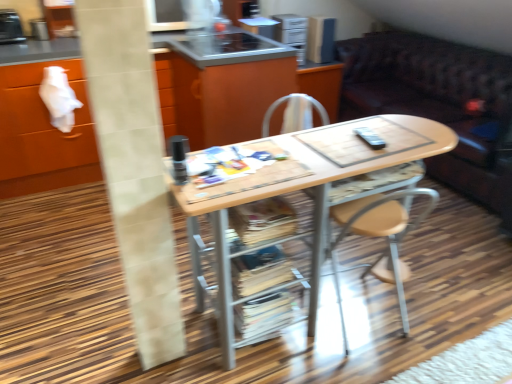
What do you see at coordinates (320, 39) in the screenshot? I see `metallic silver toaster at upper center, placed as the first appliance when sorted from right to left` at bounding box center [320, 39].

Locate an element on the screen. This screenshot has height=384, width=512. wooden/matte desk at center is located at coordinates (316, 205).

Find the location of a particular element. This screenshot has width=512, height=384. wooden cabinet at center is located at coordinates (42, 134).

Image resolution: width=512 pixels, height=384 pixels. In order to click on brown leather couch at center in this screenshot , I will do `click(439, 104)`.

This screenshot has height=384, width=512. Identify the location of metallic stainless steel toaster at upper left, the first appliance in the left-to-right sequence. (10, 27).

Locate an element on the screen. This screenshot has height=384, width=512. white tile pillar at left is located at coordinates (134, 168).

Where is `metallic silver toaster at upper center, the third appliance in the front-to-back sequence`? This screenshot has height=384, width=512. metallic silver toaster at upper center, the third appliance in the front-to-back sequence is located at coordinates (320, 39).

From the image's perspective, relative to wooden cabinet at center, is metallic silver toaster at upper center, the third appliance in the front-to-back sequence, above or below?

From the image's perspective, metallic silver toaster at upper center, the third appliance in the front-to-back sequence, appears above wooden cabinet at center.

Is metallic silver toaster at upper center, placed as the first appliance when sorted from right to left, thinner than wooden cabinet at center?

Correct, the width of metallic silver toaster at upper center, placed as the first appliance when sorted from right to left, is less than that of wooden cabinet at center.

How different are the orientations of metallic silver toaster at upper center, the 3th appliance viewed from the left, and wooden cabinet at center in degrees?

There is a 0.000151-degree angle between the facing directions of metallic silver toaster at upper center, the 3th appliance viewed from the left, and wooden cabinet at center.

Considering the positions of objects metallic silver toaster at upper center, placed as the 1th appliance when sorted from back to front, and wooden cabinet at center in the image provided, who is more to the right, metallic silver toaster at upper center, placed as the 1th appliance when sorted from back to front, or wooden cabinet at center?

metallic silver toaster at upper center, placed as the 1th appliance when sorted from back to front, is more to the right.

Could you tell me if brown leather couch at center is facing wooden/matte desk at center?

Yes, brown leather couch at center is aimed at wooden/matte desk at center.

Based on the photo, considering the relative sizes of brown leather couch at center and wooden/matte desk at center in the image provided, is brown leather couch at center taller than wooden/matte desk at center?

In fact, brown leather couch at center may be shorter than wooden/matte desk at center.

Which of these two, brown leather couch at center or wooden/matte desk at center, is thinner?

wooden/matte desk at center is thinner.

Considering the relative sizes of white tile pillar at left and metallic silver microwave at upper center, which is the second appliance in back-to-front order, in the image provided, is white tile pillar at left thinner than metallic silver microwave at upper center, which is the second appliance in back-to-front order,?

Correct, the width of white tile pillar at left is less than that of metallic silver microwave at upper center, which is the second appliance in back-to-front order.

Where is `pillar on the left of metallic silver microwave at upper center, which is the 2th appliance from right to left`? pillar on the left of metallic silver microwave at upper center, which is the 2th appliance from right to left is located at coordinates (134, 168).

From a real-world perspective, is white tile pillar at left physically below metallic silver microwave at upper center, which is the second appliance in back-to-front order?

Yes.

Can you confirm if white tile pillar at left is smaller than metallic silver microwave at upper center, which is the second appliance in back-to-front order?

No, white tile pillar at left is not smaller than metallic silver microwave at upper center, which is the second appliance in back-to-front order.

Is metallic silver toaster at upper center, the 3th appliance viewed from the left, wider than white tile pillar at left?

Correct, the width of metallic silver toaster at upper center, the 3th appliance viewed from the left, exceeds that of white tile pillar at left.

Is metallic silver toaster at upper center, placed as the first appliance when sorted from right to left, surrounding white tile pillar at left?

Definitely not — white tile pillar at left is not inside metallic silver toaster at upper center, placed as the first appliance when sorted from right to left.

Which is closer, (318, 60) or (121, 162)?

Point (121, 162)

Is metallic silver toaster at upper center, the third appliance in the front-to-back sequence, far from white tile pillar at left?

Yes, metallic silver toaster at upper center, the third appliance in the front-to-back sequence, and white tile pillar at left are located far from each other.

From a real-world perspective, which is physically above, white tile pillar at left or wooden/matte desk at center?

In real-world perspective, white tile pillar at left is above.

Which of these two, white tile pillar at left or wooden/matte desk at center, stands taller?

white tile pillar at left is taller.

Is white tile pillar at left positioned with its back to wooden/matte desk at center?

A: That's not correct — white tile pillar at left is not looking away from wooden/matte desk at center.

Are white tile pillar at left and wooden/matte desk at center far apart?

white tile pillar at left is actually quite close to wooden/matte desk at center.

Is wooden/matte desk at center beside metallic silver microwave at upper center, which is the 2th appliance from right to left?

wooden/matte desk at center and metallic silver microwave at upper center, which is the 2th appliance from right to left, are clearly separated.

Is wooden/matte desk at center aimed at metallic silver microwave at upper center, arranged as the second appliance when viewed from the left?

No, wooden/matte desk at center is not facing towards metallic silver microwave at upper center, arranged as the second appliance when viewed from the left.

Can you confirm if wooden/matte desk at center is smaller than metallic silver microwave at upper center, which is the 2th appliance from right to left?

No, wooden/matte desk at center is not smaller than metallic silver microwave at upper center, which is the 2th appliance from right to left.

Considering the relative sizes of metallic silver microwave at upper center, which is the 2th appliance from right to left, and wooden cabinet at center in the image provided, is metallic silver microwave at upper center, which is the 2th appliance from right to left, taller than wooden cabinet at center?

No, metallic silver microwave at upper center, which is the 2th appliance from right to left, is not taller than wooden cabinet at center.

From the image's perspective, between metallic silver microwave at upper center, arranged as the second appliance when viewed from the left, and wooden cabinet at center, who is located below?

wooden cabinet at center appears lower in the image.

Which is closer to the camera, (247, 21) or (14, 79)?

Point (247, 21) is positioned farther from the camera compared to point (14, 79).

From the image's perspective, which appliance is the 3rd one above the wooden cabinet at center? Please provide its 2D coordinates.

[(320, 39)]

At what (x,y) coordinates should I click in order to perform the action: click on studio couch that is under the wooden/matte desk at center (from a real-world perspective). Please return your answer as a coordinate pair (x, y). Looking at the image, I should click on (439, 104).

When comparing their distances from metallic silver microwave at upper center, which is the second appliance in back-to-front order, does metallic stainless steel toaster at upper left, the first appliance in the left-to-right sequence, or metallic silver toaster at upper center, the third appliance in the front-to-back sequence, seem further?

Among the two, metallic stainless steel toaster at upper left, the first appliance in the left-to-right sequence, is located further to metallic silver microwave at upper center, which is the second appliance in back-to-front order.

Which object lies further to the anchor point metallic silver microwave at upper center, which is the second appliance in back-to-front order, metallic silver toaster at upper center, placed as the first appliance when sorted from right to left, or wooden cabinet at center?

The object further to metallic silver microwave at upper center, which is the second appliance in back-to-front order, is wooden cabinet at center.

Based on their spatial positions, is metallic silver microwave at upper center, which is the second appliance in back-to-front order, or metallic silver toaster at upper center, the 3th appliance viewed from the left, closer to metallic stainless steel toaster at upper left, arranged as the 3th appliance when viewed from the right?

metallic silver microwave at upper center, which is the second appliance in back-to-front order, is positioned closer to the anchor metallic stainless steel toaster at upper left, arranged as the 3th appliance when viewed from the right.

Considering their positions, is metallic stainless steel toaster at upper left, the first appliance in the left-to-right sequence, positioned closer to wooden/matte desk at center than wooden cabinet at center?

Based on the image, wooden cabinet at center appears to be nearer to wooden/matte desk at center.

Based on their spatial positions, is wooden/matte desk at center or metallic silver toaster at upper center, the third appliance in the front-to-back sequence, closer to metallic silver microwave at upper center, which is the 2th appliance from right to left?

metallic silver toaster at upper center, the third appliance in the front-to-back sequence, lies closer to metallic silver microwave at upper center, which is the 2th appliance from right to left, than the other object.

Based on their spatial positions, is brown leather couch at center or white tile pillar at left closer to metallic silver toaster at upper center, placed as the 1th appliance when sorted from back to front?

brown leather couch at center is closer to metallic silver toaster at upper center, placed as the 1th appliance when sorted from back to front.

Considering their positions, is metallic silver toaster at upper center, placed as the first appliance when sorted from right to left, positioned closer to metallic stainless steel toaster at upper left, the first appliance in the left-to-right sequence, than wooden cabinet at center?

wooden cabinet at center lies closer to metallic stainless steel toaster at upper left, the first appliance in the left-to-right sequence, than the other object.

Which object lies further to the anchor point white tile pillar at left, metallic stainless steel toaster at upper left, the first appliance in the left-to-right sequence, or brown leather couch at center?

brown leather couch at center is positioned further to the anchor white tile pillar at left.

What are the coordinates of `cabinetry between metallic stainless steel toaster at upper left, which is counted as the 1th appliance, starting from the front, and brown leather couch at center` in the screenshot? It's located at (42, 134).

Identify the location of cabinetry situated between metallic stainless steel toaster at upper left, placed as the third appliance when sorted from back to front, and metallic silver toaster at upper center, the third appliance in the front-to-back sequence, from left to right. This screenshot has height=384, width=512. (42, 134).

Find the location of a particular element. The width and height of the screenshot is (512, 384). cabinetry between metallic stainless steel toaster at upper left, placed as the third appliance when sorted from back to front, and metallic silver microwave at upper center, acting as the second appliance starting from the front, in the horizontal direction is located at coordinates (42, 134).

This screenshot has height=384, width=512. I want to click on pillar between metallic stainless steel toaster at upper left, placed as the third appliance when sorted from back to front, and brown leather couch at center from left to right, so click(x=134, y=168).